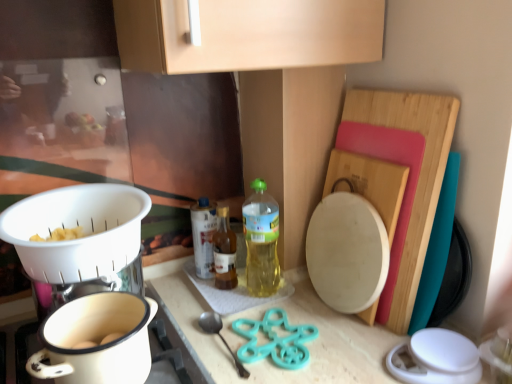
Question: From a real-world perspective, is teal plastic spoon at lower center located higher than translucent plastic bottle at center, which ranks as the 3th bottle in left-to-right order?

Choices:
 (A) no
 (B) yes

Answer: (A)

Question: From the image's perspective, would you say teal plastic spoon at lower center is positioned over translucent plastic bottle at center, which ranks as the 3th bottle in left-to-right order?

Choices:
 (A) no
 (B) yes

Answer: (A)

Question: Is the depth of teal plastic spoon at lower center less than that of translucent plastic bottle at center, which is the 1th bottle from right to left?

Choices:
 (A) yes
 (B) no

Answer: (A)

Question: Is teal plastic spoon at lower center to the right of translucent plastic bottle at center, which ranks as the 3th bottle in left-to-right order, from the viewer's perspective?

Choices:
 (A) yes
 (B) no

Answer: (B)

Question: Would you say teal plastic spoon at lower center is a long distance from translucent plastic bottle at center, which ranks as the 3th bottle in left-to-right order?

Choices:
 (A) yes
 (B) no

Answer: (B)

Question: Is white plastic colander at left in front of or behind teal plastic spoon at lower center in the image?

Choices:
 (A) front
 (B) behind

Answer: (A)

Question: Considering the positions of white plastic colander at left and teal plastic spoon at lower center in the image, is white plastic colander at left bigger or smaller than teal plastic spoon at lower center?

Choices:
 (A) big
 (B) small

Answer: (A)

Question: From a real-world perspective, is white plastic colander at left physically located above or below teal plastic spoon at lower center?

Choices:
 (A) above
 (B) below

Answer: (A)

Question: In terms of height, does white plastic colander at left look taller or shorter compared to teal plastic spoon at lower center?

Choices:
 (A) short
 (B) tall

Answer: (B)

Question: From a real-world perspective, is white ceramic pot at lower left positioned above or below translucent plastic bottle at center, positioned as the 1th bottle in left-to-right order?

Choices:
 (A) below
 (B) above

Answer: (B)

Question: Considering their positions, is white ceramic pot at lower left located in front of or behind translucent plastic bottle at center, marked as the 3th bottle in a right-to-left arrangement?

Choices:
 (A) behind
 (B) front

Answer: (B)

Question: Looking at their shapes, would you say white ceramic pot at lower left is wider or thinner than translucent plastic bottle at center, marked as the 3th bottle in a right-to-left arrangement?

Choices:
 (A) thin
 (B) wide

Answer: (B)

Question: Is point (37, 370) closer or farther from the camera than point (201, 271)?

Choices:
 (A) farther
 (B) closer

Answer: (B)

Question: Would you say translucent plastic bottle at center, which ranks as the 3th bottle in left-to-right order, is to the left or to the right of wooden cutting board at right in the picture?

Choices:
 (A) right
 (B) left

Answer: (B)

Question: Is point (273, 256) closer or farther from the camera than point (395, 251)?

Choices:
 (A) closer
 (B) farther

Answer: (B)